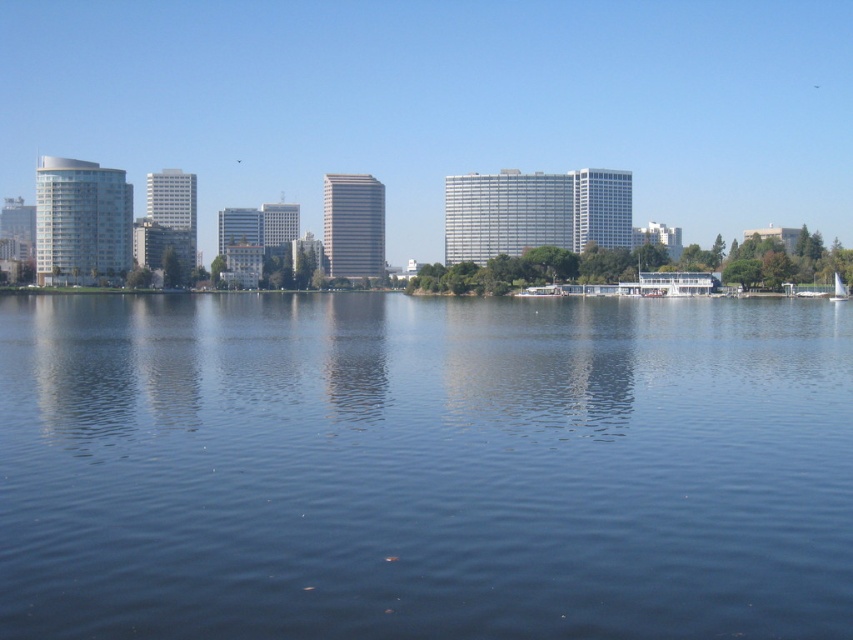
You are standing at the waterfront and see two points marked in the scene. The first point is at coordinates point (x=663, y=563) and the second is at point (x=834, y=292). Which point is closer to you?

Point (x=663, y=563) is in front of point (x=834, y=292), so it is closer to you.

Looking at this image, you are standing on the dock and see the blue liquid water at center and the white sailboat at center. Which object is closer to the sky?

The white sailboat at center is closer to the sky because the blue liquid water at center is located below it.

You are standing on the shore and see the blue liquid water at center and the white sailboat at center. Which object is closer to you?

The blue liquid water at center is closer to you because it is in front of the white sailboat at center.